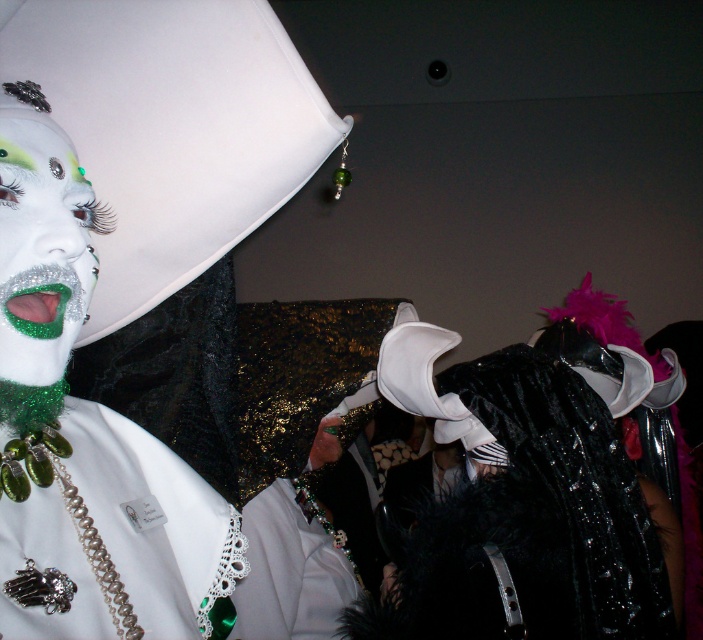
You are standing in the center of the image. There is a point at coordinates (527,496). What object is located at that point?

The point at coordinates (527,496) indicates the shiny black cape at center.